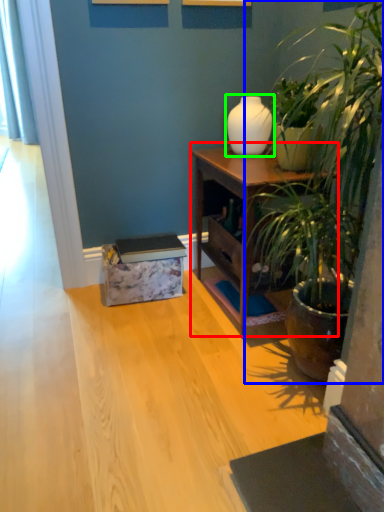
Question: Which is farther away from nightstand (highlighted by a red box)? houseplant (highlighted by a blue box) or vase (highlighted by a green box)?

Choices:
 (A) houseplant
 (B) vase

Answer: (A)